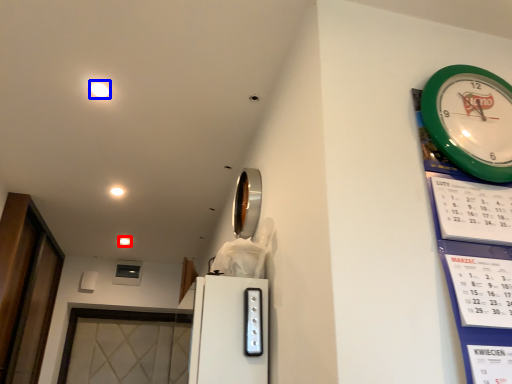
Question: Among these objects, which one is farthest to the camera, light (highlighted by a red box) or light (highlighted by a blue box)?

Choices:
 (A) light
 (B) light

Answer: (A)